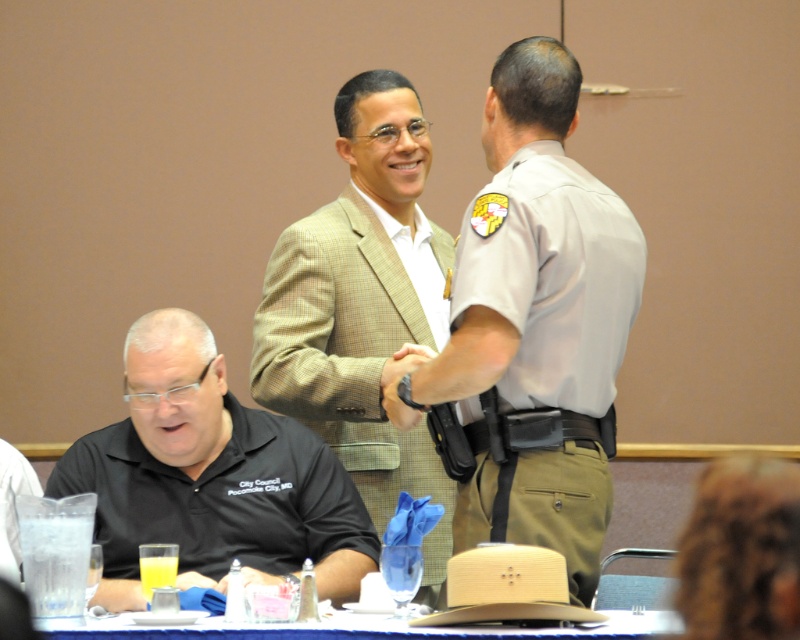
Does khaki textured suit at upper center appear under blue fabric table at lower center?

Incorrect, khaki textured suit at upper center is not positioned below blue fabric table at lower center.

Does khaki textured suit at upper center have a larger size compared to blue fabric table at lower center?

No.

Is point (478, 362) positioned before point (334, 620)?

No, (478, 362) is further to viewer.

This screenshot has width=800, height=640. I want to click on khaki textured suit at upper center, so (x=536, y=323).

Who is more distant from viewer, (x=517, y=428) or (x=164, y=371)?

The point (x=164, y=371) is behind.

Can you confirm if khaki textured suit at upper center is positioned to the left of black matte shirt at lower left?

No, khaki textured suit at upper center is not to the left of black matte shirt at lower left.

Between point (578, 84) and point (124, 518), which one is positioned in front?

Point (578, 84)

Image resolution: width=800 pixels, height=640 pixels. Identify the location of khaki textured suit at upper center. (536, 323).

Is light brown textured blazer at center below blue fabric table at lower center?

Actually, light brown textured blazer at center is above blue fabric table at lower center.

Is point (400, 134) farther from camera compared to point (536, 636)?

Yes.

What do you see at coordinates (362, 307) in the screenshot? Image resolution: width=800 pixels, height=640 pixels. I see `light brown textured blazer at center` at bounding box center [362, 307].

This screenshot has height=640, width=800. In order to click on light brown textured blazer at center in this screenshot , I will do (x=362, y=307).